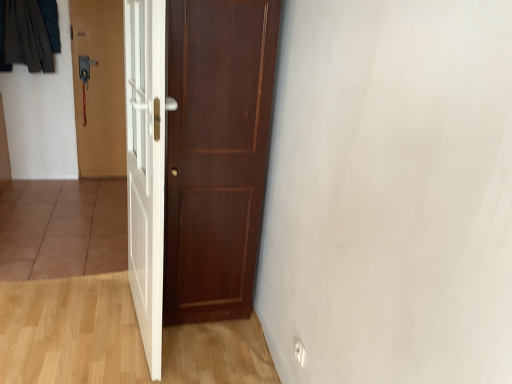
This screenshot has height=384, width=512. I want to click on vacant space in white glossy door at center, the third door when ordered from back to front (from a real-world perspective), so click(x=133, y=332).